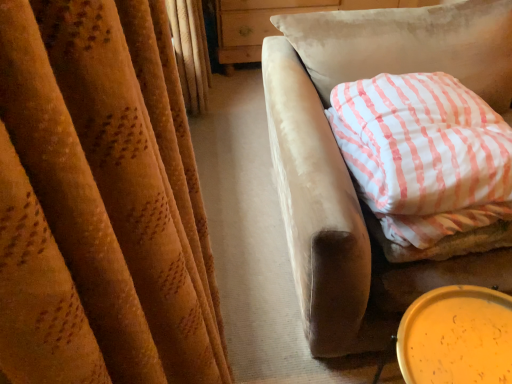
Question: Do you think yellow plastic lid at lower right is within white striped fabric pillow at right, or outside of it?

Choices:
 (A) outside
 (B) inside

Answer: (A)

Question: Is yellow plastic lid at lower right taller or shorter than white striped fabric pillow at right?

Choices:
 (A) short
 (B) tall

Answer: (B)

Question: In the image, is yellow plastic lid at lower right on the left side or the right side of white striped fabric pillow at right?

Choices:
 (A) left
 (B) right

Answer: (A)

Question: Considering the positions of point (478, 155) and point (444, 364), is point (478, 155) closer or farther from the camera than point (444, 364)?

Choices:
 (A) farther
 (B) closer

Answer: (A)

Question: From the image's perspective, is white striped fabric pillow at right located above or below yellow plastic lid at lower right?

Choices:
 (A) above
 (B) below

Answer: (A)

Question: Based on their positions, is white striped fabric pillow at right located to the left or right of yellow plastic lid at lower right?

Choices:
 (A) right
 (B) left

Answer: (A)

Question: Looking at the image, does white striped fabric pillow at right seem bigger or smaller compared to yellow plastic lid at lower right?

Choices:
 (A) big
 (B) small

Answer: (A)